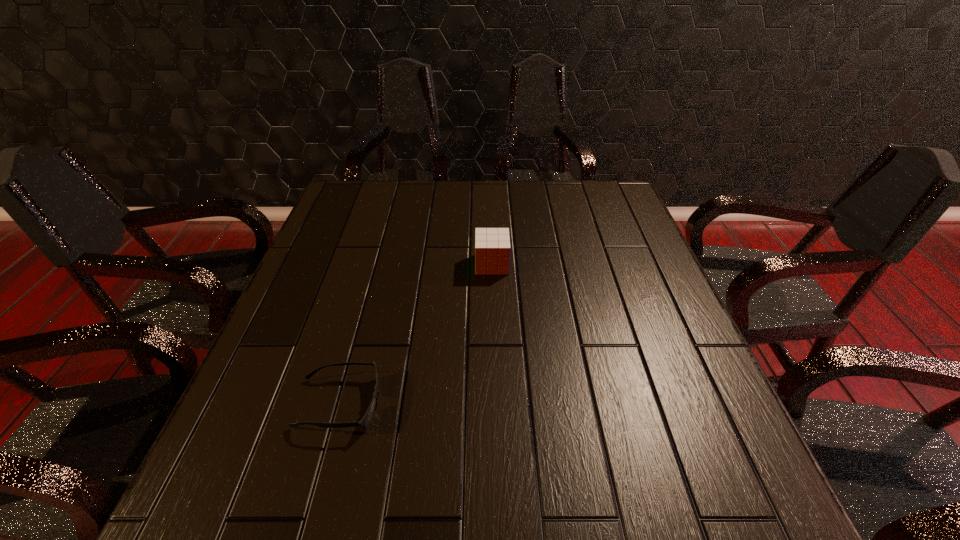
In the image, there is a desktop. At what (x,y) coordinates should I click in order to perform the action: click on vacant region at the right edge. Please return your answer as a coordinate pair (x, y). The image size is (960, 540). Looking at the image, I should click on (680, 461).

The image size is (960, 540). I want to click on vacant region at the near right corner of the desktop, so click(775, 522).

The image size is (960, 540). What are the coordinates of `free space that satisfies the following two spatial constraints: 1. on the front side of the taller object; 2. on the front-facing side of the shorter object` in the screenshot? It's located at (496, 403).

Image resolution: width=960 pixels, height=540 pixels. What are the coordinates of `vacant area in the image that satisfies the following two spatial constraints: 1. on the front side of the farther object; 2. on the front-facing side of the shorter object` in the screenshot? It's located at (496, 403).

The width and height of the screenshot is (960, 540). Find the location of `free point that satisfies the following two spatial constraints: 1. on the front side of the farther object; 2. on the front-facing side of the shorter object`. free point that satisfies the following two spatial constraints: 1. on the front side of the farther object; 2. on the front-facing side of the shorter object is located at coordinates (496, 403).